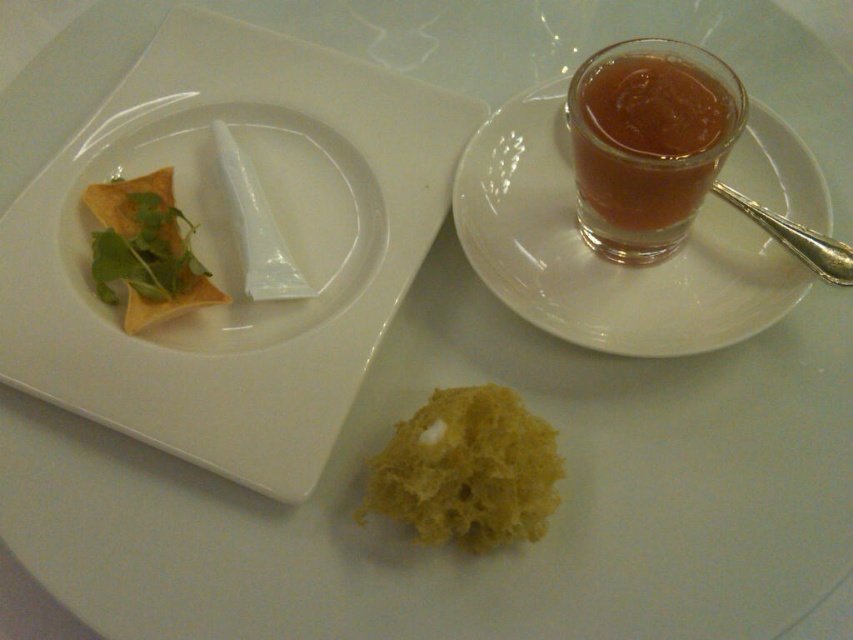
You are a server setting up a table for a customer. You have a 10 cm wide coaster. You need to place it under either the translucent amber liquid at upper right or the matte yellow tortilla at upper left. Which object should you place it under to ensure it fits?

The translucent amber liquid at upper right has a larger width than the matte yellow tortilla at upper left. Since the coaster is 10 cm wide, it should be placed under the matte yellow tortilla at upper left to ensure it fits, as the tortilla is narrower.

You are setting up a food display and want to ensure proper visibility of all items. Given the arrangement of the transparent glass saucer at upper right and the matte yellow tortilla at upper left, will the tortilla be visible underneath the saucer?

The transparent glass saucer at upper right is positioned over matte yellow tortilla at upper left, so yes, the tortilla will be visible underneath the saucer since the saucer is transparent.

You are setting up a small table for a tea ceremony. You have a transparent glass saucer at upper right and a yellow sponge at center. Which item should you move to make space for a teapot that requires a wider base?

The transparent glass saucer at upper right might be wider than the yellow sponge at center, so you should move the transparent glass saucer at upper right to accommodate the teapot.